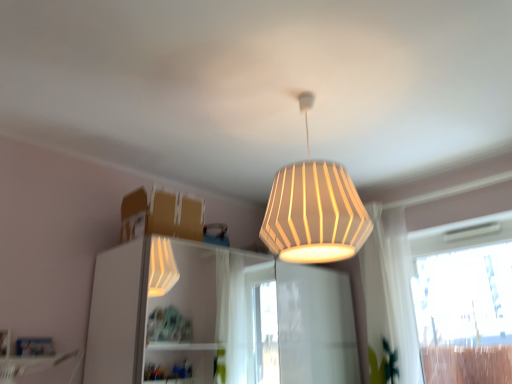
Question: Would you say white glossy dresser at center contains transparent glass window at right?

Choices:
 (A) no
 (B) yes

Answer: (A)

Question: Is white glossy dresser at center located outside transparent glass window at right?

Choices:
 (A) yes
 (B) no

Answer: (A)

Question: Is white glossy dresser at center thinner than transparent glass window at right?

Choices:
 (A) no
 (B) yes

Answer: (A)

Question: Does white glossy dresser at center come behind transparent glass window at right?

Choices:
 (A) yes
 (B) no

Answer: (B)

Question: Is white glossy dresser at center aimed at transparent glass window at right?

Choices:
 (A) yes
 (B) no

Answer: (A)

Question: Is white glossy dresser at center at the left side of transparent glass window at right?

Choices:
 (A) yes
 (B) no

Answer: (A)

Question: From the image's perspective, does white glossy dresser at center appear higher than white ribbed lampshade at upper center?

Choices:
 (A) yes
 (B) no

Answer: (B)

Question: Could you tell me if white glossy dresser at center is facing white ribbed lampshade at upper center?

Choices:
 (A) yes
 (B) no

Answer: (B)

Question: Can white ribbed lampshade at upper center be found inside white glossy dresser at center?

Choices:
 (A) yes
 (B) no

Answer: (B)

Question: Can you confirm if white glossy dresser at center is thinner than white ribbed lampshade at upper center?

Choices:
 (A) no
 (B) yes

Answer: (A)

Question: Considering the relative positions of white glossy dresser at center and white ribbed lampshade at upper center in the image provided, is white glossy dresser at center in front of white ribbed lampshade at upper center?

Choices:
 (A) no
 (B) yes

Answer: (A)

Question: Does white glossy dresser at center have a greater width compared to white ribbed lampshade at upper center?

Choices:
 (A) yes
 (B) no

Answer: (A)

Question: Considering the relative sizes of white ribbed lampshade at upper center and white sheer curtain at right in the image provided, is white ribbed lampshade at upper center shorter than white sheer curtain at right?

Choices:
 (A) yes
 (B) no

Answer: (A)